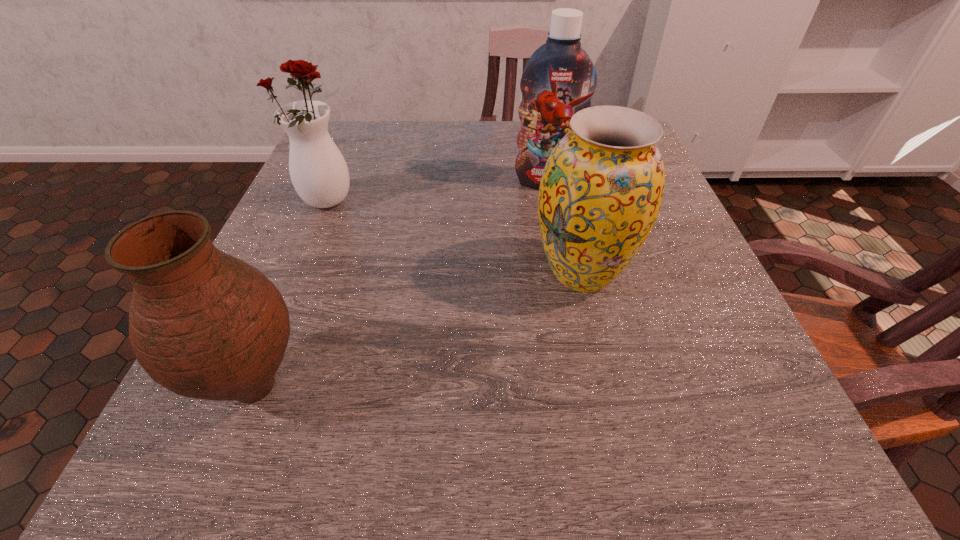
You are a GUI agent. You are given a task and a screenshot of the screen. Output one action in this format:
    pyautogui.click(x=<x>, y=<y>)
    Task: Click on the shampoo
    
    Given the screenshot: What is the action you would take?
    pyautogui.click(x=559, y=79)

Where is `the farthest vase`? The image size is (960, 540). the farthest vase is located at coordinates (318, 171).

Where is `the second nearest vase`? the second nearest vase is located at coordinates (601, 190).

Identify the location of the third farthest object. (601, 190).

Locate an element on the screen. This screenshot has height=540, width=960. the nearest object is located at coordinates (203, 324).

Locate an element on the screen. vacant space situated 0.130m on the front label of the shampoo is located at coordinates (556, 230).

Locate an element on the screen. This screenshot has height=540, width=960. vacant space situated 0.050m on the back of the farthest vase is located at coordinates (339, 174).

The height and width of the screenshot is (540, 960). Identify the location of vacant space located 0.080m on the back of the second nearest object. (568, 215).

The height and width of the screenshot is (540, 960). I want to click on vacant area situated 0.230m on the back of the nearest object, so click(x=314, y=242).

Where is `object located at the near edge`? object located at the near edge is located at coordinates (203, 324).